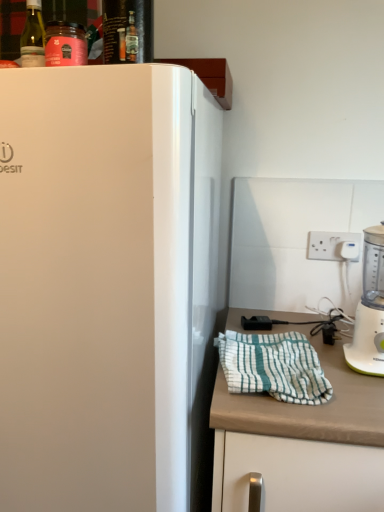
Question: Is white plastic blender at right at the right side of white matte countertop at lower right?

Choices:
 (A) no
 (B) yes

Answer: (B)

Question: Considering the relative sizes of white plastic blender at right and white matte countertop at lower right in the image provided, is white plastic blender at right wider than white matte countertop at lower right?

Choices:
 (A) no
 (B) yes

Answer: (A)

Question: Is white plastic blender at right oriented towards white matte countertop at lower right?

Choices:
 (A) no
 (B) yes

Answer: (A)

Question: From the image's perspective, is white plastic blender at right below white matte countertop at lower right?

Choices:
 (A) no
 (B) yes

Answer: (A)

Question: Is white plastic blender at right looking in the opposite direction of white matte countertop at lower right?

Choices:
 (A) no
 (B) yes

Answer: (A)

Question: Can you confirm if white plastic blender at right is thinner than white matte countertop at lower right?

Choices:
 (A) no
 (B) yes

Answer: (B)

Question: Can you confirm if white plastic blender at right is shorter than white striped cloth at lower right?

Choices:
 (A) no
 (B) yes

Answer: (A)

Question: From the image's perspective, is white plastic blender at right on white striped cloth at lower right?

Choices:
 (A) no
 (B) yes

Answer: (B)

Question: Is white plastic blender at right far from white striped cloth at lower right?

Choices:
 (A) no
 (B) yes

Answer: (A)

Question: Does white plastic blender at right have a larger size compared to white striped cloth at lower right?

Choices:
 (A) yes
 (B) no

Answer: (A)

Question: Is white plastic blender at right at the right side of white striped cloth at lower right?

Choices:
 (A) no
 (B) yes

Answer: (B)

Question: Is white plastic blender at right located outside white striped cloth at lower right?

Choices:
 (A) no
 (B) yes

Answer: (B)

Question: Considering the relative sizes of white plastic blender at right and shiny glass bottle at upper center in the image provided, is white plastic blender at right bigger than shiny glass bottle at upper center?

Choices:
 (A) no
 (B) yes

Answer: (B)